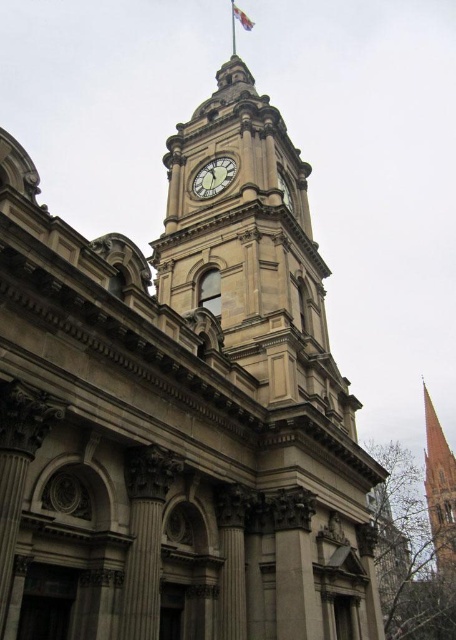
Question: Is gold textured clock at center bigger than white fabric flag at upper center?

Choices:
 (A) no
 (B) yes

Answer: (A)

Question: Which point is farther from the camera taking this photo?

Choices:
 (A) (238, 8)
 (B) (222, 184)

Answer: (A)

Question: Is gold textured clock at center positioned in front of white fabric flag at upper center?

Choices:
 (A) no
 (B) yes

Answer: (B)

Question: Which point is farther from the camera taking this photo?

Choices:
 (A) (247, 16)
 (B) (191, 192)
 (C) (435, 413)

Answer: (A)

Question: Based on their relative distances, which object is farther from the gold textured clock at center?

Choices:
 (A) smooth stone spire at right
 (B) white fabric flag at upper center

Answer: (B)

Question: From the image, what is the correct spatial relationship of smooth stone spire at right in relation to white fabric flag at upper center?

Choices:
 (A) above
 (B) below

Answer: (B)